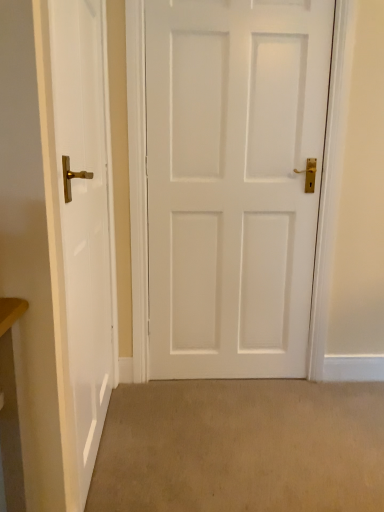
Locate an element on the screen. free region under white glossy door at left, the 2th door from the right (from a real-world perspective) is located at coordinates (113, 442).